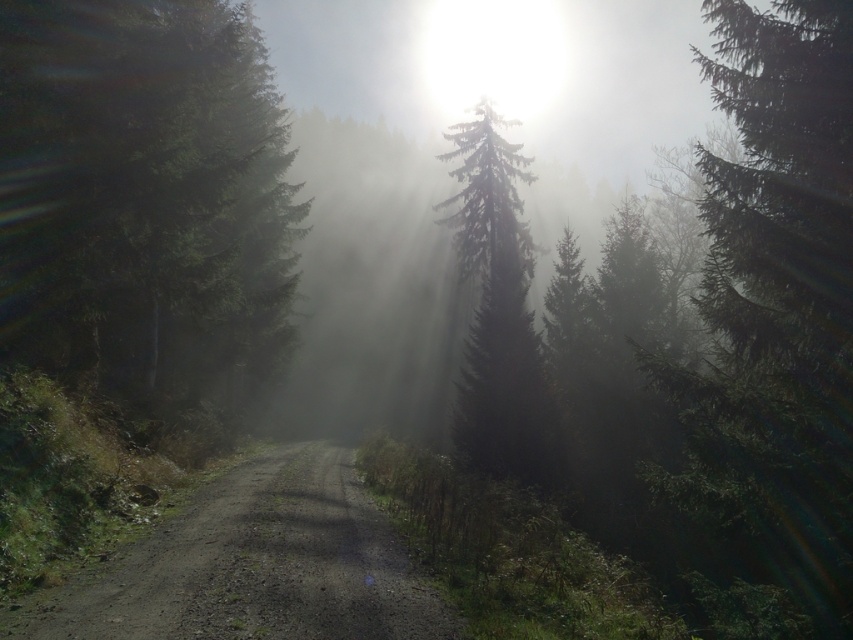
You are standing at the point marked by the coordinates point (144, 202) in the forest scene. What object is located exactly at that point?

The point (144, 202) indicates a green matte tree at left.